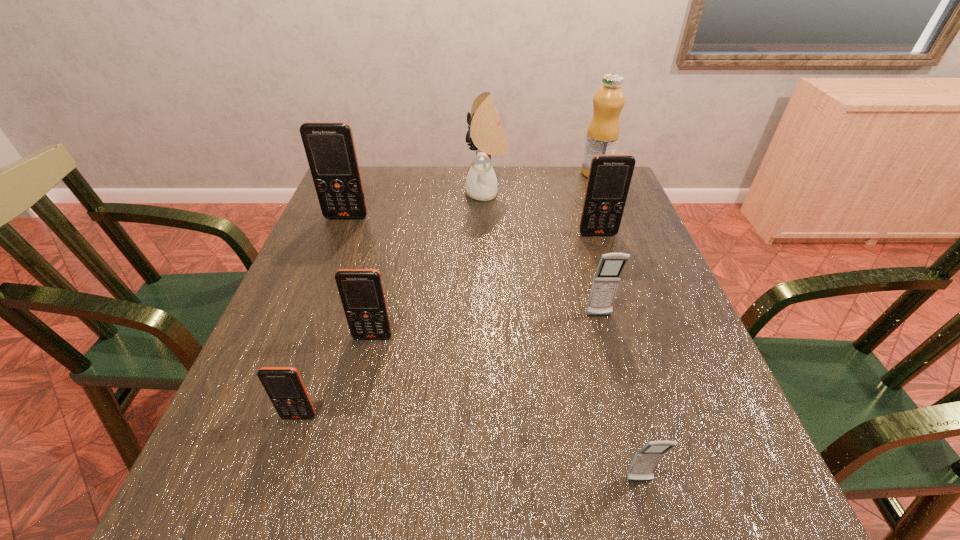
The image size is (960, 540). In order to click on fruit juice in this screenshot , I will do `click(603, 131)`.

Identify the location of black doll. (487, 138).

Where is `the fifth object from right to left`? This screenshot has height=540, width=960. the fifth object from right to left is located at coordinates (487, 138).

In order to click on the farthest cellular telephone in this screenshot , I will do `click(329, 146)`.

I want to click on the tallest cellular telephone, so click(x=329, y=146).

The height and width of the screenshot is (540, 960). Identify the location of the second tallest cellular telephone. (609, 179).

Image resolution: width=960 pixels, height=540 pixels. What are the coordinates of `the second farthest cellular telephone` in the screenshot? It's located at (609, 179).

You are a GUI agent. You are given a task and a screenshot of the screen. Output one action in this format:
    pyautogui.click(x=<x>, y=<y>)
    Task: Click on the bigger gray cellular telephone
    Image resolution: width=960 pixels, height=540 pixels.
    Given the screenshot: What is the action you would take?
    pyautogui.click(x=606, y=280)

Image resolution: width=960 pixels, height=540 pixels. I want to click on the fifth farthest object, so coord(606,280).

Identify the location of the second nearest orange cellular telephone. (361, 291).